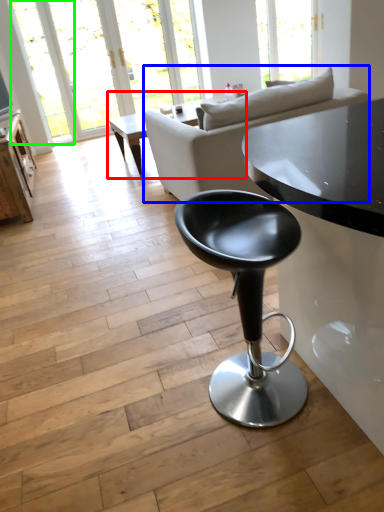
Question: Which is farther away from coffee table (highlighted by a red box)? studio couch (highlighted by a blue box) or window (highlighted by a green box)?

Choices:
 (A) studio couch
 (B) window

Answer: (A)